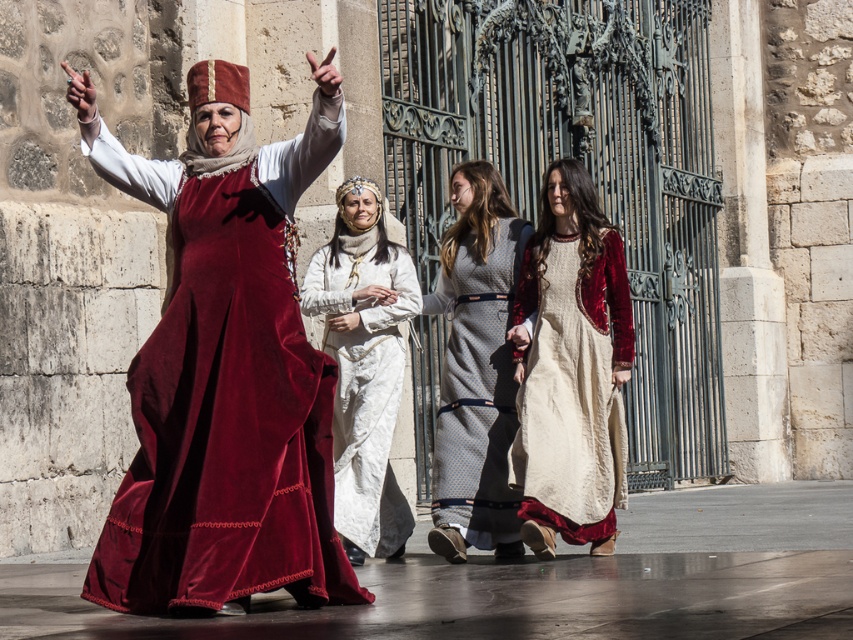
Question: Which object is the farthest from the velvet beige dress at center?

Choices:
 (A) velvet dress at left
 (B) white silk dress at center
 (C) velvet gray dress at center

Answer: (A)

Question: Is velvet beige dress at center positioned before velvet gray dress at center?

Choices:
 (A) no
 (B) yes

Answer: (B)

Question: Does velvet beige dress at center appear on the left side of velvet gray dress at center?

Choices:
 (A) yes
 (B) no

Answer: (B)

Question: Does velvet gray dress at center appear on the left side of white silk dress at center?

Choices:
 (A) no
 (B) yes

Answer: (A)

Question: Which point is closer to the camera taking this photo?

Choices:
 (A) (386, 499)
 (B) (194, 424)
 (C) (498, 307)

Answer: (B)

Question: Estimate the real-world distances between objects in this image. Which object is farther from the white silk dress at center?

Choices:
 (A) velvet dress at left
 (B) velvet beige dress at center
 (C) velvet gray dress at center

Answer: (A)